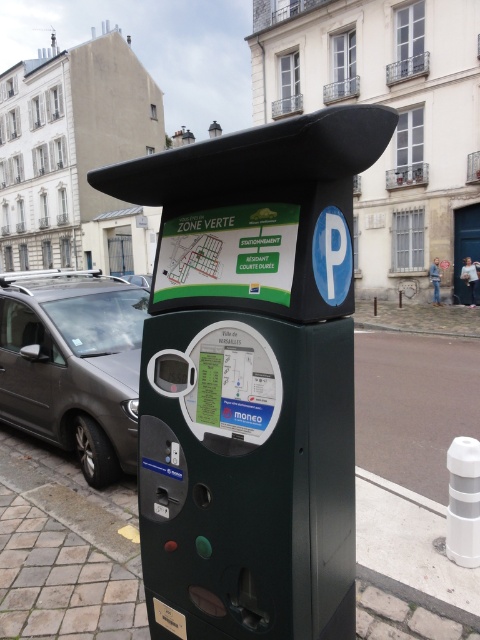
Can you confirm if green plastic parking meter at center is positioned to the right of dark gray metallic van at left?

Yes, green plastic parking meter at center is to the right of dark gray metallic van at left.

Who is more distant from viewer, (x=268, y=605) or (x=134, y=428)?

The point (x=134, y=428) is more distant.

Identify the location of green plastic parking meter at center. This screenshot has width=480, height=640. (251, 378).

Is green plastic parking meter at center to the left of dark gray paving stone at lower left from the viewer's perspective?

Incorrect, green plastic parking meter at center is not on the left side of dark gray paving stone at lower left.

Is green plastic parking meter at center to the right of dark gray paving stone at lower left from the viewer's perspective?

Correct, you'll find green plastic parking meter at center to the right of dark gray paving stone at lower left.

At what (x,y) coordinates should I click in order to perform the action: click on green plastic parking meter at center. Please return your answer as a coordinate pair (x, y). The height and width of the screenshot is (640, 480). Looking at the image, I should click on (251, 378).

Between point (460, 636) and point (54, 397), which one is positioned behind?

The point (54, 397) is more distant.

Which is more to the right, dark gray paving stone at lower left or dark gray metallic van at left?

Positioned to the right is dark gray paving stone at lower left.

Identify the location of dark gray paving stone at lower left. The width and height of the screenshot is (480, 640). (66, 548).

Locate an element on the screen. Image resolution: width=480 pixels, height=640 pixels. dark gray paving stone at lower left is located at coordinates (66, 548).